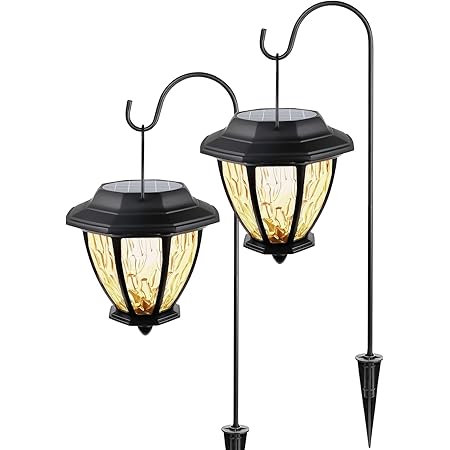
Where is `glass`? glass is located at coordinates (148, 273).